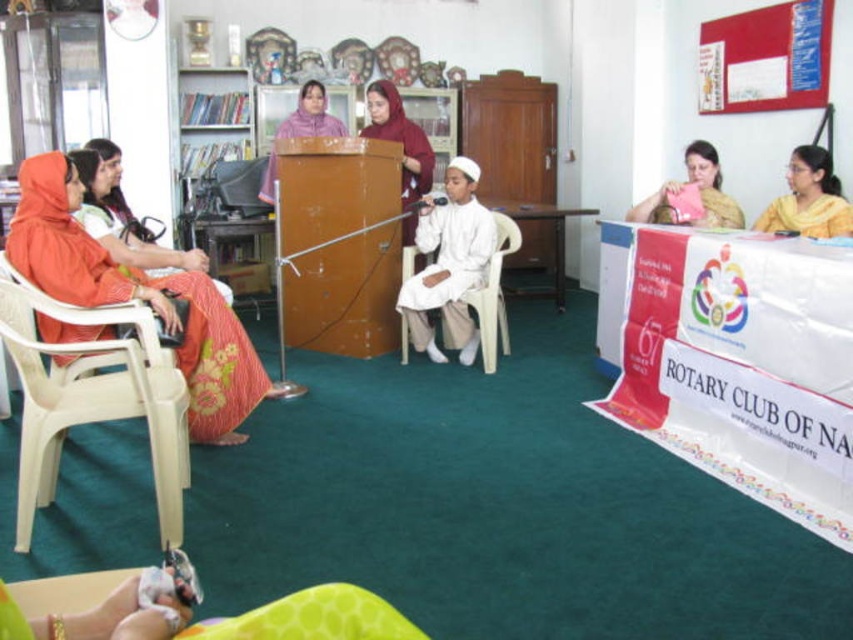
Question: Observing the image, what is the correct spatial positioning of orange fabric dress at left in reference to yellow silk saree at upper right?

Choices:
 (A) right
 (B) left

Answer: (B)

Question: Which point appears farthest from the camera in this image?

Choices:
 (A) (33, 484)
 (B) (160, 278)
 (C) (409, 237)

Answer: (C)

Question: Can you confirm if translucent plastic chair at left is thinner than pink fabric at center?

Choices:
 (A) no
 (B) yes

Answer: (A)

Question: Which is nearer to the yellow silk saree at upper right?

Choices:
 (A) orange fabric dress at left
 (B) white plastic chair at center
 (C) maroon fabric headscarf at center
 (D) purple fabric at center

Answer: (B)

Question: Observing the image, what is the correct spatial positioning of yellow silk saree at upper right in reference to white plastic chair at center?

Choices:
 (A) left
 (B) right

Answer: (B)

Question: Based on their relative distances, which object is farther from the yellow silk saree at upper right?

Choices:
 (A) maroon fabric headscarf at center
 (B) pink fabric at center
 (C) white plastic chair at center
 (D) purple fabric at center

Answer: (D)